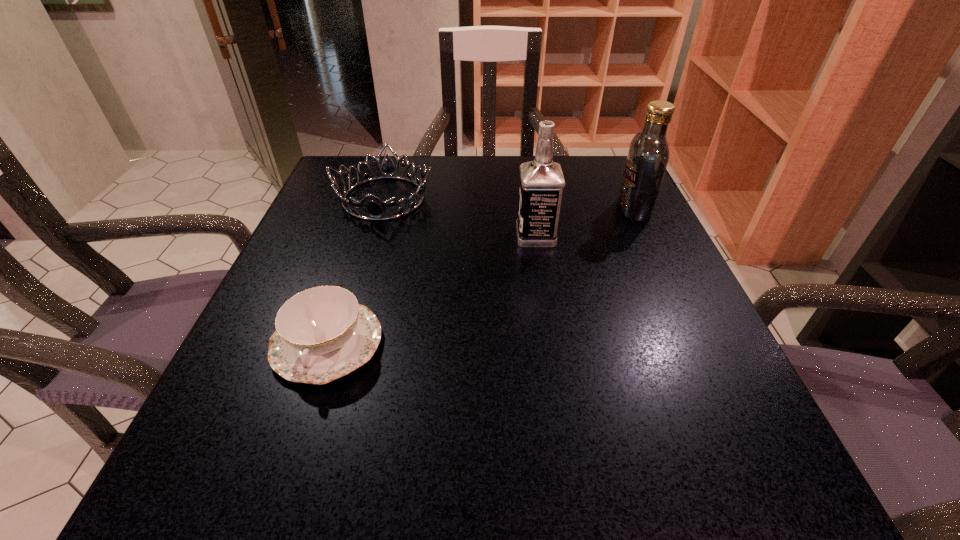
Find the location of a particular element. The height and width of the screenshot is (540, 960). blank space located on the front-facing side of the farther vodka is located at coordinates [440, 210].

This screenshot has width=960, height=540. I want to click on vacant space located on the front-facing side of the farther vodka, so click(550, 210).

Where is `vacant area situated on the front-facing side of the farther vodka`? vacant area situated on the front-facing side of the farther vodka is located at coordinates 517,210.

I want to click on free spot located 0.270m on the front-facing side of the tiara, so (346, 326).

Identify the location of vodka located at the far edge. The image size is (960, 540). (648, 156).

Find the location of a particular element. Image resolution: width=960 pixels, height=540 pixels. tiara that is at the far edge is located at coordinates (376, 213).

You are a GUI agent. You are given a task and a screenshot of the screen. Output one action in this format:
    pyautogui.click(x=<x>, y=<y>)
    Task: Click on the tiara at the left edge
    Image resolution: width=960 pixels, height=540 pixels.
    Given the screenshot: What is the action you would take?
    coord(376,213)

This screenshot has width=960, height=540. I want to click on chinaware at the left edge, so click(x=322, y=333).

The image size is (960, 540). What are the coordinates of `object situated at the right edge` in the screenshot? It's located at (648, 156).

At what (x,y) coordinates should I click in order to perform the action: click on object positioned at the far left corner. Please return your answer as a coordinate pair (x, y). Looking at the image, I should click on (376, 213).